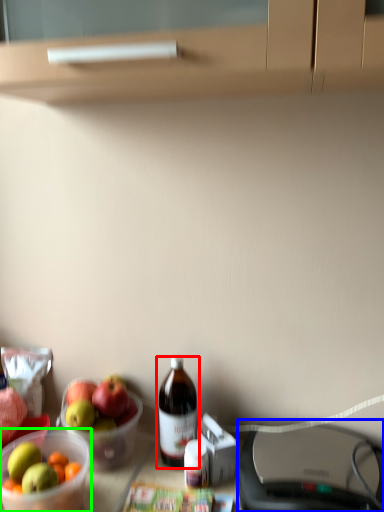
Question: Based on their relative distances, which object is farther from bottle (highlighted by a red box)? Choose from wide (highlighted by a blue box) and bowl (highlighted by a green box).

Choices:
 (A) wide
 (B) bowl

Answer: (A)